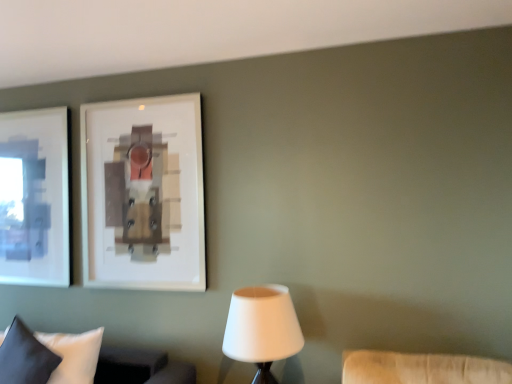
What do you see at coordinates (262, 329) in the screenshot?
I see `white matte lampshade at lower center` at bounding box center [262, 329].

Measure the distance between dark blue fabric pillow at lower left and camera.

dark blue fabric pillow at lower left is 6.64 feet away from camera.

This screenshot has width=512, height=384. I want to click on white fabric pillow at lower left, so click(x=136, y=365).

This screenshot has height=384, width=512. Find the location of `white matte lampshade at lower center`. white matte lampshade at lower center is located at coordinates 262,329.

From the image's perspective, which one is positioned lower, white fabric pillow at lower left or dark blue fabric pillow at lower left?

white fabric pillow at lower left, from the image's perspective.

Does white fabric pillow at lower left have a greater width compared to dark blue fabric pillow at lower left?

Correct, the width of white fabric pillow at lower left exceeds that of dark blue fabric pillow at lower left.

The height and width of the screenshot is (384, 512). Identify the location of furniture that appears below the dark blue fabric pillow at lower left (from a real-world perspective). (136, 365).

From a real-world perspective, which is physically above, white fabric pillow at lower left or dark blue fabric pillow at lower left?

From a 3D spatial view, dark blue fabric pillow at lower left is above.

Can you confirm if white matte lampshade at lower center is wider than white fabric pillow at lower left?

Yes.

From the picture: Between white matte lampshade at lower center and white fabric pillow at lower left, which one has more height?

Standing taller between the two is white matte lampshade at lower center.

The width and height of the screenshot is (512, 384). I want to click on lamp lying above the white fabric pillow at lower left (from the image's perspective), so click(262, 329).

Is point (286, 315) farther from viewer compared to point (25, 359)?

No, (286, 315) is in front of (25, 359).

From a real-world perspective, is white matte lampshade at lower center above or below dark blue fabric pillow at lower left?

From a real-world perspective, white matte lampshade at lower center is physically above dark blue fabric pillow at lower left.

Is white matte lampshade at lower center not inside dark blue fabric pillow at lower left?

white matte lampshade at lower center lies outside dark blue fabric pillow at lower left's area.

Is white matte lampshade at lower center next to dark blue fabric pillow at lower left and touching it?

white matte lampshade at lower center and dark blue fabric pillow at lower left are clearly separated.

Is white matte lampshade at lower center shorter than dark blue fabric pillow at lower left?

In fact, white matte lampshade at lower center may be taller than dark blue fabric pillow at lower left.

Based on the photo, what's the angular difference between dark blue fabric pillow at lower left and white fabric pillow at lower left's facing directions?

There is a 4.48-degree angle between the facing directions of dark blue fabric pillow at lower left and white fabric pillow at lower left.

Which is behind, point (35, 344) or point (191, 380)?

The point (191, 380) is farther from the camera.

Is dark blue fabric pillow at lower left turned away from white fabric pillow at lower left?

Yes.

Is the surface of dark blue fabric pillow at lower left in direct contact with white fabric pillow at lower left?

dark blue fabric pillow at lower left and white fabric pillow at lower left are clearly separated.

From a real-world perspective, is dark blue fabric pillow at lower left positioned above or below white matte lampshade at lower center?

From a real-world perspective, dark blue fabric pillow at lower left is physically below white matte lampshade at lower center.

Is dark blue fabric pillow at lower left not near white matte lampshade at lower center?

Yes, dark blue fabric pillow at lower left and white matte lampshade at lower center are quite far apart.

Does point (56, 357) come in front of point (233, 306)?

No, it is not.

From the image's perspective, between dark blue fabric pillow at lower left and white matte lampshade at lower center, who is located below?

From the image's view, dark blue fabric pillow at lower left is below.

From a real-world perspective, relative to white matte lampshade at lower center, is white fabric pillow at lower left vertically above or below?

Clearly, from a real-world perspective, white fabric pillow at lower left is below white matte lampshade at lower center.

Is white fabric pillow at lower left outside of white matte lampshade at lower center?

Absolutely, white fabric pillow at lower left is external to white matte lampshade at lower center.

Which is behind, white fabric pillow at lower left or white matte lampshade at lower center?

white fabric pillow at lower left is further from the camera.

In order to click on furniture on the right side of dark blue fabric pillow at lower left in this screenshot , I will do `click(136, 365)`.

Image resolution: width=512 pixels, height=384 pixels. What are the coordinates of `lamp that is in front of the white fabric pillow at lower left` in the screenshot? It's located at (262, 329).

Estimate the real-world distances between objects in this image. Which object is further from white matte lampshade at lower center, dark blue fabric pillow at lower left or white fabric pillow at lower left?

dark blue fabric pillow at lower left.

Estimate the real-world distances between objects in this image. Which object is closer to white matte lampshade at lower center, white fabric pillow at lower left or dark blue fabric pillow at lower left?

white fabric pillow at lower left is closer to white matte lampshade at lower center.

Considering their positions, is white matte lampshade at lower center positioned closer to white fabric pillow at lower left than dark blue fabric pillow at lower left?

dark blue fabric pillow at lower left is closer to white fabric pillow at lower left.

Which object lies nearer to the anchor point dark blue fabric pillow at lower left, white matte lampshade at lower center or white fabric pillow at lower left?

white fabric pillow at lower left is positioned closer to the anchor dark blue fabric pillow at lower left.

Looking at the image, which one is located closer to white fabric pillow at lower left, dark blue fabric pillow at lower left or white matte lampshade at lower center?

Based on the image, dark blue fabric pillow at lower left appears to be nearer to white fabric pillow at lower left.

Which object lies nearer to the anchor point dark blue fabric pillow at lower left, white fabric pillow at lower left or white matte lampshade at lower center?

The object closer to dark blue fabric pillow at lower left is white fabric pillow at lower left.

Find the location of a particular element. This screenshot has height=384, width=512. furniture between dark blue fabric pillow at lower left and white matte lampshade at lower center is located at coordinates (136, 365).